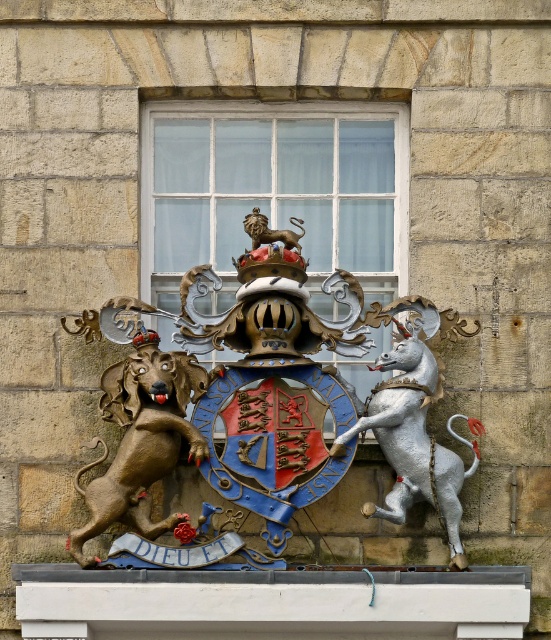
Who is more distant from viewer, (359, 186) or (175, 612)?

Positioned behind is point (359, 186).

Who is higher up, white glass window at center or white marble ledge at center?

white glass window at center is higher up.

Is point (380, 144) closer to viewer compared to point (273, 589)?

No, (380, 144) is further to viewer.

Locate an element on the screen. This screenshot has width=551, height=640. white glass window at center is located at coordinates (276, 193).

Who is lower down, white glass window at center or bronze/statue dog at left?

bronze/statue dog at left is lower down.

Which of these two, white glass window at center or bronze/statue dog at left, stands taller?

white glass window at center is taller.

This screenshot has height=640, width=551. What do you see at coordinates (276, 193) in the screenshot?
I see `white glass window at center` at bounding box center [276, 193].

Where is `white glass window at center`? Image resolution: width=551 pixels, height=640 pixels. white glass window at center is located at coordinates (276, 193).

Can you confirm if polished bronze lion at center is positioned below bronze/statue dog at left?

No, polished bronze lion at center is not below bronze/statue dog at left.

Who is positioned more to the left, polished bronze lion at center or bronze/statue dog at left?

Positioned to the left is bronze/statue dog at left.

Measure the distance between point [293,493] and camera.

They are 90.21 meters apart.

Image resolution: width=551 pixels, height=640 pixels. Find the location of `polished bronze lion at center`. polished bronze lion at center is located at coordinates (234, 390).